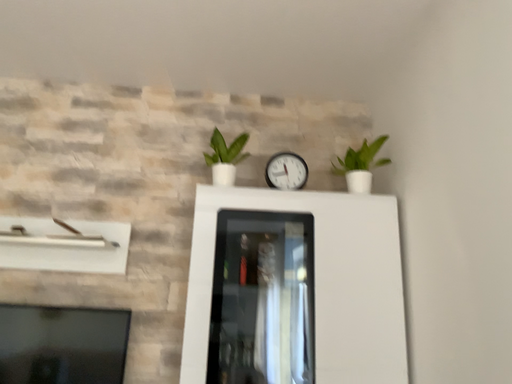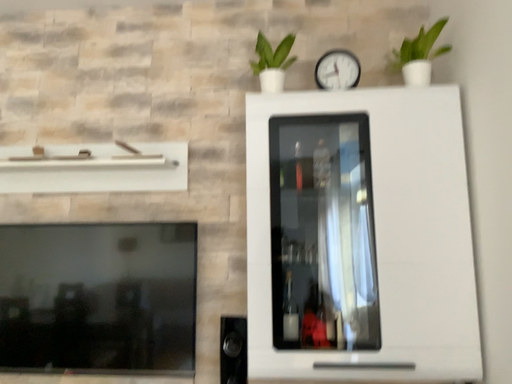
Question: Which way did the camera rotate in the video?

Choices:
 (A) rotated left
 (B) rotated right

Answer: (A)